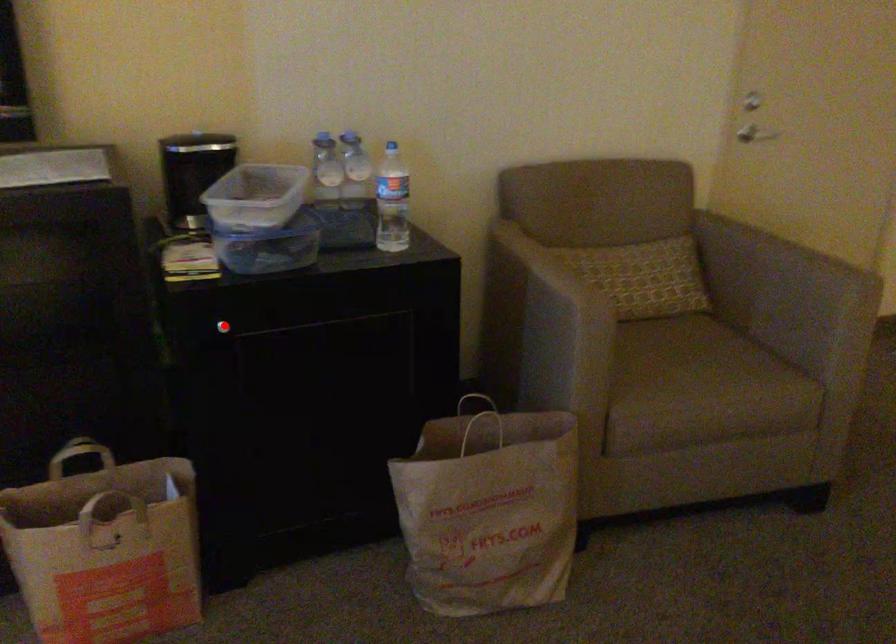
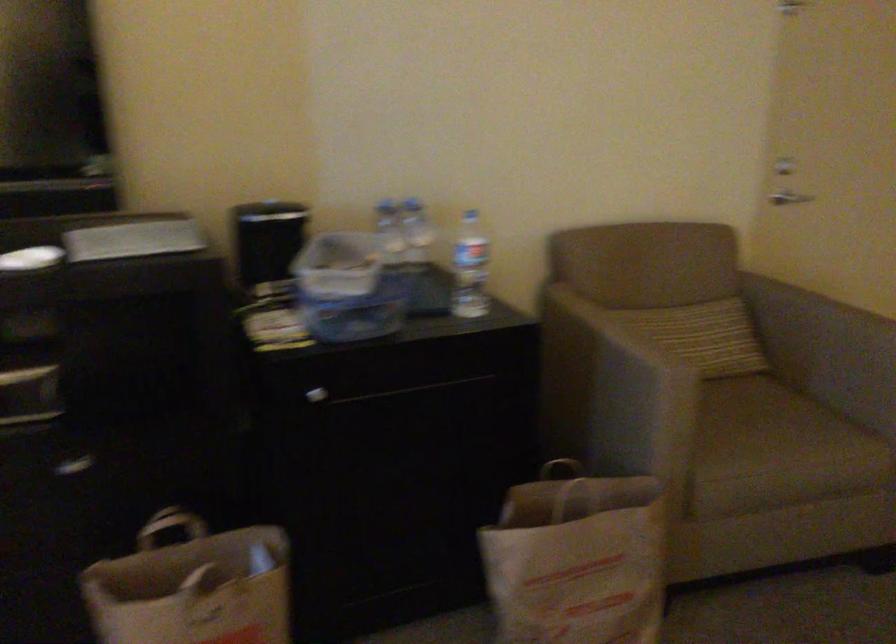
Find the pixel in the second image that matches the highlighted location in the first image.

(316, 395)